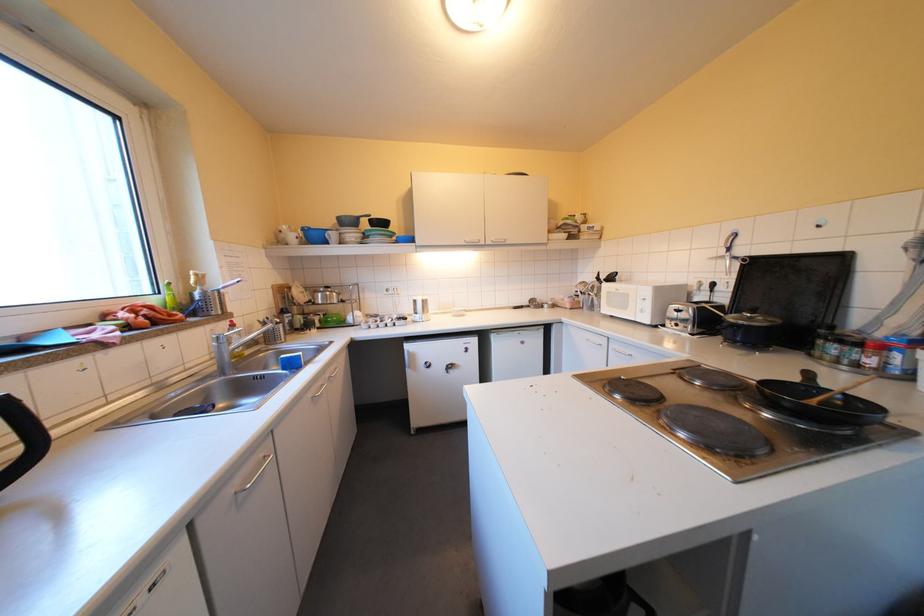
Where is `white mug`? This screenshot has width=924, height=616. white mug is located at coordinates (292, 238).